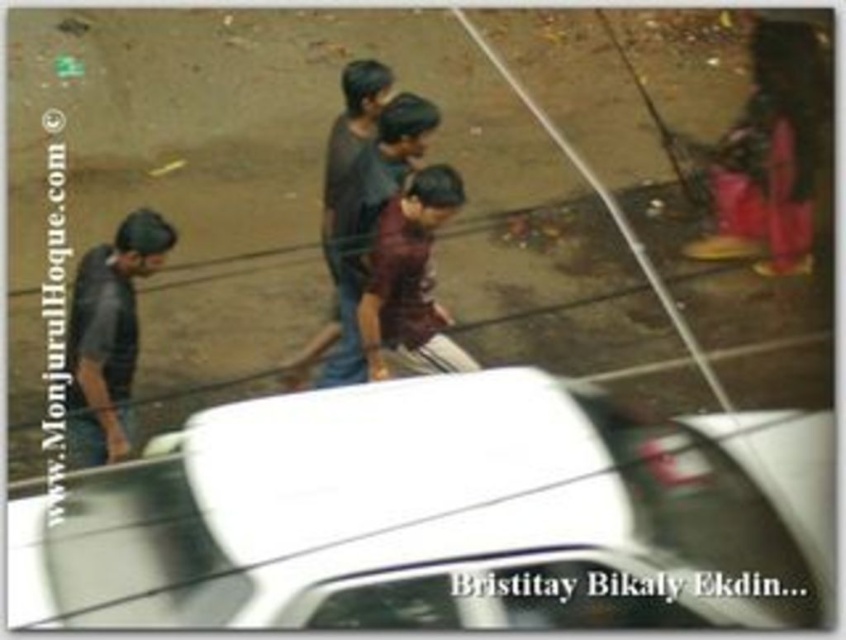
You are a delivery person with a package that needs to be placed between the white glossy car at lower center and the dark blue jeans at left. The package is 1.8 meters long. Can you fit it between them without moving either object?

The distance between the white glossy car at lower center and the dark blue jeans at left is 1.77 meters, which is shorter than the package length of 1.8 meters. Therefore, the package cannot fit between them without moving either object.

You are sitting in the car and looking out the window. You see two points marked on the reflection of the pavement. The first point is at coordinate point(69, 429) and the second is at point(418, 227). Which point is closer to you?

Point(69, 429) is in front of point(418, 227), so it is closer to you.